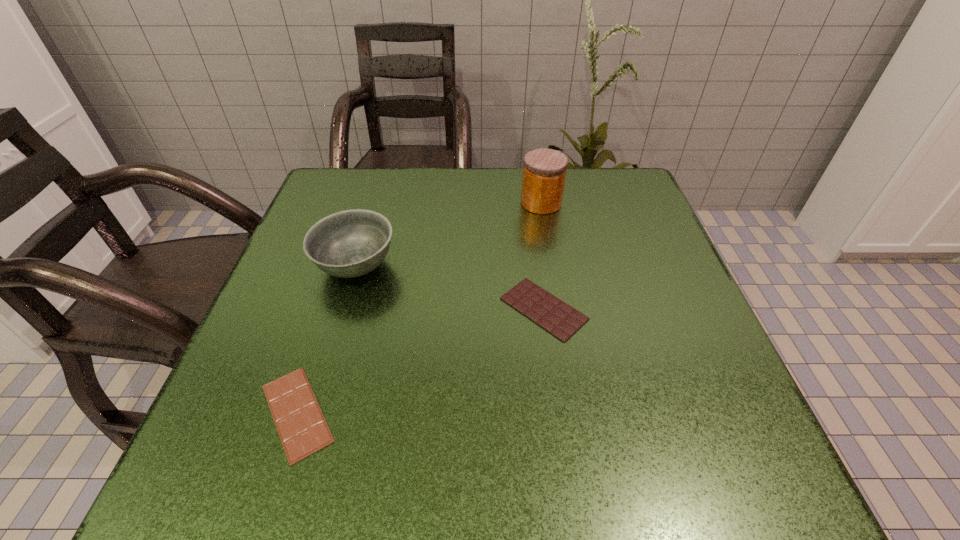
You are a GUI agent. You are given a task and a screenshot of the screen. Output one action in this format:
    pyautogui.click(x=<x>, y=<y>)
    Task: Click on the free space at the near left corner of the desktop
    
    Given the screenshot: What is the action you would take?
    pyautogui.click(x=217, y=437)

This screenshot has width=960, height=540. I want to click on free location at the far right corner of the desktop, so click(598, 168).

In the image, there is a desktop. What are the coordinates of `free space at the near right corner` in the screenshot? It's located at (696, 467).

Locate an element on the screen. This screenshot has width=960, height=540. free spot between the bowl and the tallest object is located at coordinates (448, 234).

This screenshot has width=960, height=540. Identify the location of free spot between the third shortest object and the tallest object. (448, 234).

I want to click on vacant space that is in between the second tallest object and the nearer chocolate bar, so click(x=326, y=339).

Identify the location of vacant space that's between the right chocolate bar and the nearest object. (420, 361).

Locate an element on the screen. This screenshot has width=960, height=540. unoccupied position between the left chocolate bar and the farther chocolate bar is located at coordinates (420, 361).

Identify the location of vacant region between the bowl and the farther chocolate bar. This screenshot has width=960, height=540. (450, 287).

Where is `free spot between the left chocolate bar and the third shortest object`? This screenshot has width=960, height=540. free spot between the left chocolate bar and the third shortest object is located at coordinates click(326, 339).